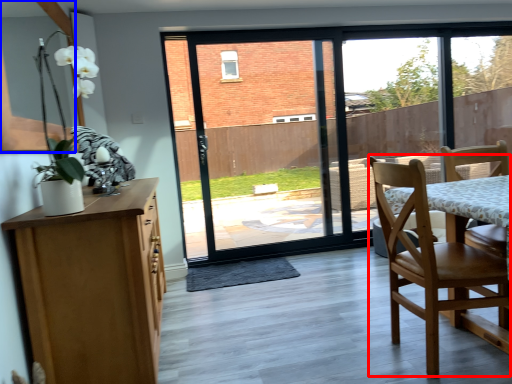
Question: Among these objects, which one is farthest to the camera, chair (highlighted by a red box) or window screen (highlighted by a blue box)?

Choices:
 (A) chair
 (B) window screen

Answer: (A)